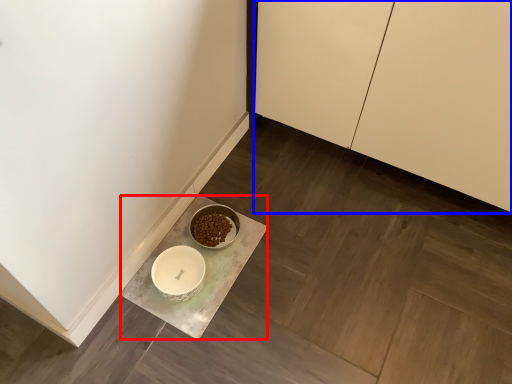
Question: Which of the following is the farthest to the observer, counter (highlighted by a red box) or cabinetry (highlighted by a blue box)?

Choices:
 (A) counter
 (B) cabinetry

Answer: (A)